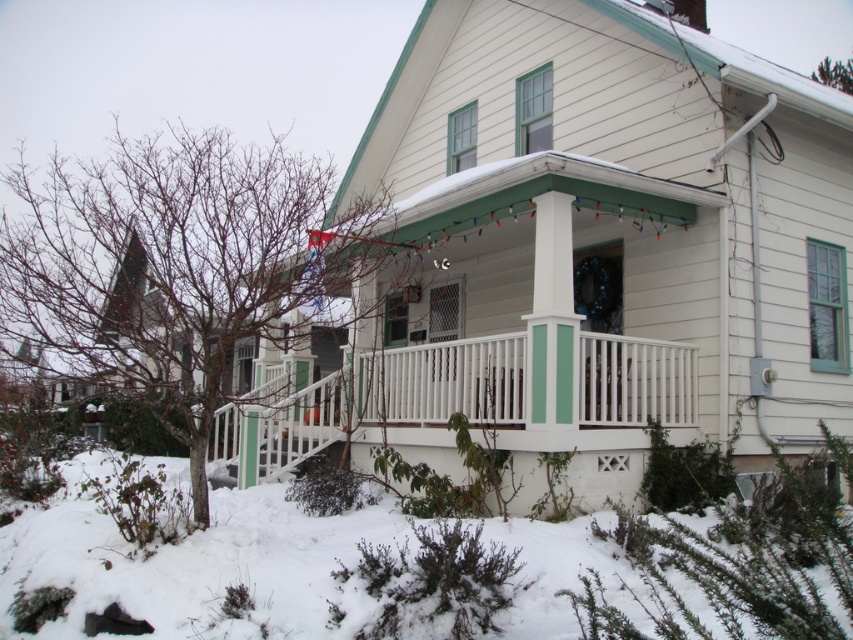
You are standing on the white painted wood porch at center and want to step onto the white fluffy snow at lower left. Is the snow directly below the porch?

Yes, the white fluffy snow at lower left is positioned under the white painted wood porch at center, so stepping down would land you on the snow.

Looking at this image, you are standing on the snowy ground in front of the house and looking at two points marked in the image. Which point, point (451,566) or point (383,396), is closer to you?

Point (451,566) is closer to the viewer than point (383,396).